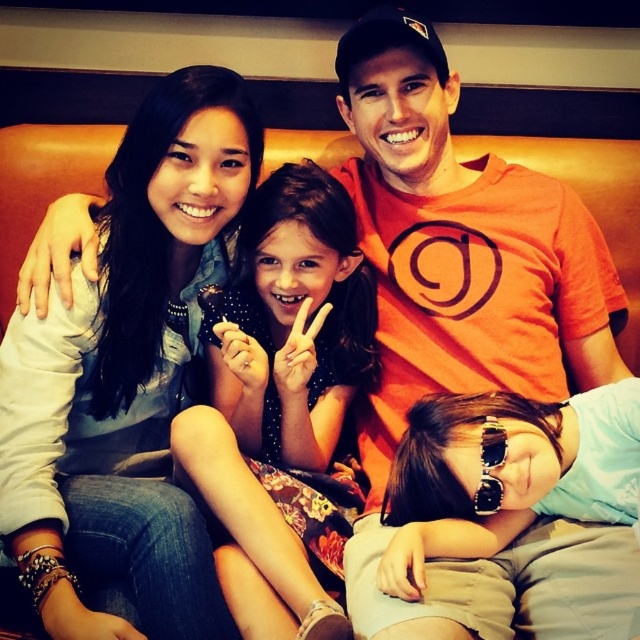
You are taking a photo of the scene and want to focus on the matte blue scarf at upper left and sunglasses at center. Which object is nearer to the camera?

The matte blue scarf at upper left is closer to the viewer than sunglasses at center, so it is nearer to the camera.

Looking at the image, which object is larger between the floral dress at center and the sunglasses at center?

The floral dress at center is bigger than the sunglasses at center.

You are a photographer who wants to capture a closeup of the sunglasses at center without the matte blue scarf at upper left appearing in the frame. Is this possible given their positions?

The matte blue scarf at upper left is positioned on the left side of sunglasses at center, so moving the camera to the right slightly might exclude the scarf while keeping the sunglasses in view.